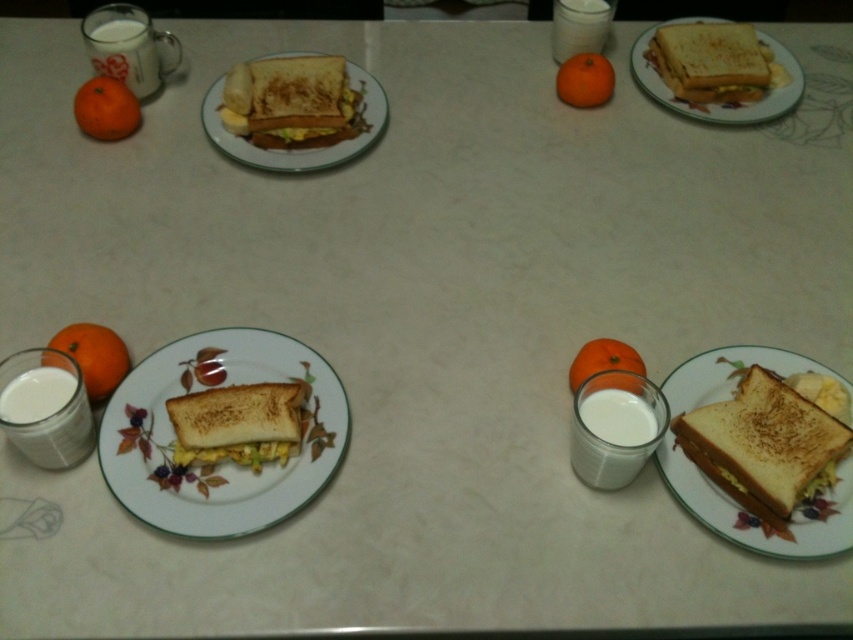
Question: Among these objects, which one is nearest to the camera?

Choices:
 (A) white ceramic plate at center
 (B) white opaque glass at upper center
 (C) white glossy plate at upper right

Answer: (A)

Question: Is white ceramic plate at center to the right of orange matte at center from the viewer's perspective?

Choices:
 (A) no
 (B) yes

Answer: (A)

Question: Which point is closer to the camera taking this photo?

Choices:
 (A) (746, 96)
 (B) (572, 52)
 (C) (558, 77)
 (D) (291, 168)

Answer: (D)

Question: Which point is closer to the camera?

Choices:
 (A) white glossy plate at upper right
 (B) white ceramic plate at center
 (C) orange matte at center
 (D) white opaque glass at lower left

Answer: (D)

Question: Is matte white plate at lower right to the right of white glossy plate at upper right from the viewer's perspective?

Choices:
 (A) yes
 (B) no

Answer: (B)

Question: Is orange matte at upper left further to camera compared to white opaque glass at upper center?

Choices:
 (A) yes
 (B) no

Answer: (B)